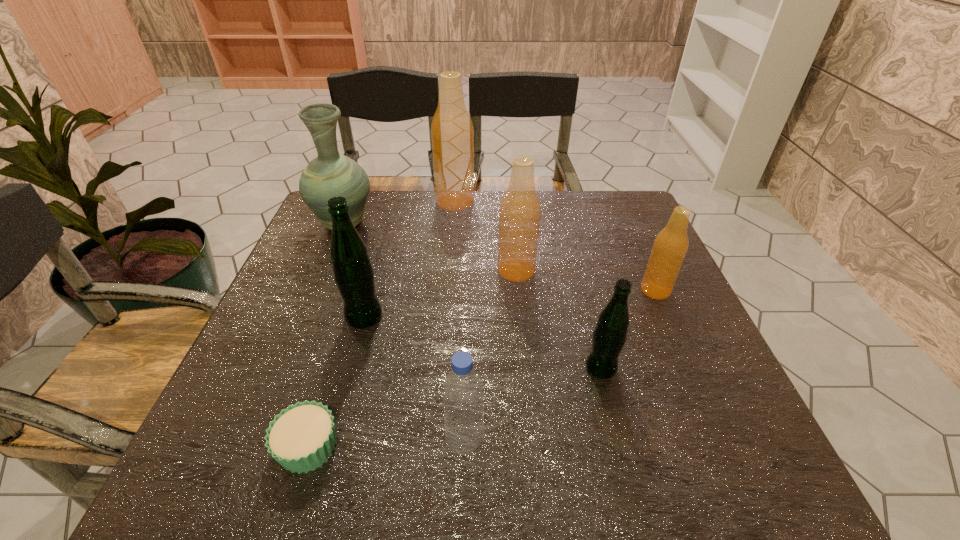
This screenshot has width=960, height=540. In order to click on vacant area that lies between the fourth nearest object and the tallest beer bottle in this screenshot , I will do `click(410, 259)`.

The height and width of the screenshot is (540, 960). I want to click on free area in between the pitcher and the farthest tan beer bottle, so click(399, 213).

This screenshot has height=540, width=960. Find the location of `vacant region between the seventh object from left to right and the pitcher`. vacant region between the seventh object from left to right and the pitcher is located at coordinates (472, 296).

Image resolution: width=960 pixels, height=540 pixels. I want to click on empty space between the rightmost tan beer bottle and the cupcake, so click(482, 368).

Find the location of a particular element. This screenshot has width=960, height=540. the third closest object relative to the cupcake is located at coordinates (609, 336).

This screenshot has width=960, height=540. What are the coordinates of `object that is the second closest to the shortest object` in the screenshot? It's located at (353, 273).

Select which beer bottle appears as the fifth closest to the pitcher. Please provide its 2D coordinates. Your answer should be formatted as a tuple, i.e. [(x, y)], where the tuple contains the x and y coordinates of a point satisfying the conditions above.

[(670, 246)]

Identify which beer bottle is the fourth closest to the rightmost tan beer bottle. Please provide its 2D coordinates. Your answer should be formatted as a tuple, i.e. [(x, y)], where the tuple contains the x and y coordinates of a point satisfying the conditions above.

[(353, 273)]

Identify the location of the second closest tan beer bottle relative to the pitcher. This screenshot has height=540, width=960. (520, 209).

This screenshot has width=960, height=540. Identify the location of tan beer bottle that is the second closest to the third beer bottle from right to left. (670, 246).